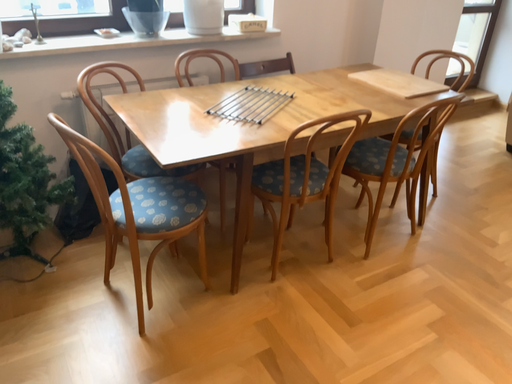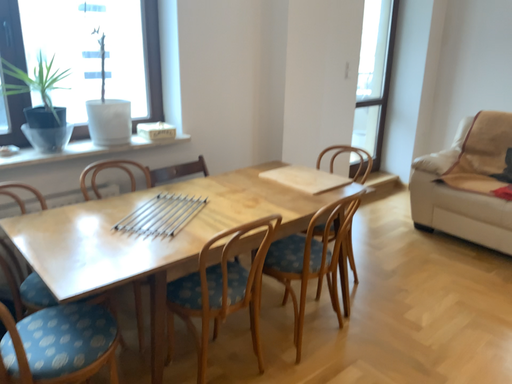
Question: Which way did the camera rotate in the video?

Choices:
 (A) rotated right
 (B) rotated left

Answer: (A)